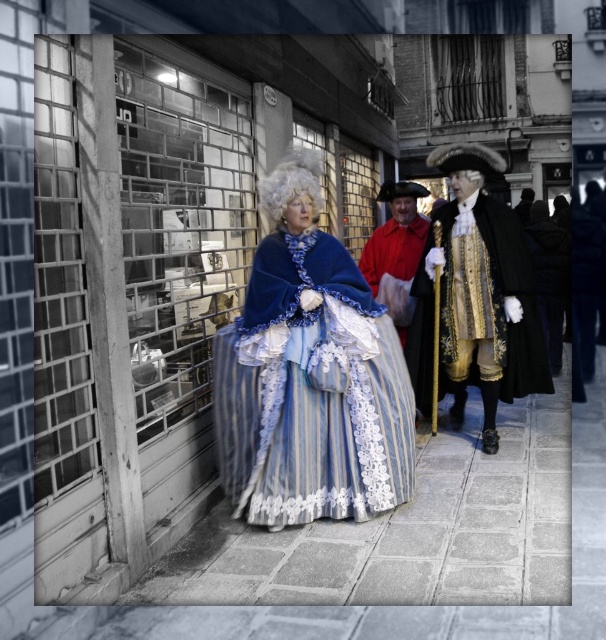
Is gold brocade coat at right wider than white fluffy wig at upper center?

Correct, the width of gold brocade coat at right exceeds that of white fluffy wig at upper center.

Is gold brocade coat at right below white fluffy wig at upper center?

Indeed, gold brocade coat at right is positioned under white fluffy wig at upper center.

Locate an element on the screen. gold brocade coat at right is located at coordinates (478, 307).

Locate an element on the screen. white curly wig at center is located at coordinates (291, 182).

Can you confirm if white curly wig at center is shorter than white fluffy wig at upper center?

Incorrect, white curly wig at center's height does not fall short of white fluffy wig at upper center's.

At what (x,y) coordinates should I click in order to perform the action: click on white curly wig at center. Please return your answer as a coordinate pair (x, y). The image size is (606, 640). Looking at the image, I should click on (291, 182).

Is clear glass display case at center to the right of gold brocade coat at right from the viewer's perspective?

No, clear glass display case at center is not to the right of gold brocade coat at right.

Does point (211, 314) come farther from viewer compared to point (507, 365)?

That is False.

You are a GUI agent. You are given a task and a screenshot of the screen. Output one action in this format:
    pyautogui.click(x=<x>, y=<y>)
    Task: Click on the clear glass display case at center
    The image size is (606, 640).
    Given the screenshot: What is the action you would take?
    pyautogui.click(x=181, y=220)